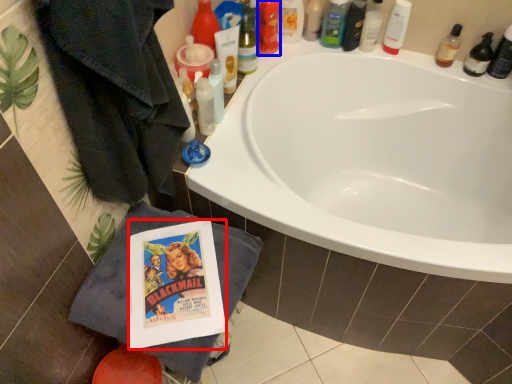
Question: Which object is closer to the camera taking this photo, comic book (highlighted by a red box) or toiletry (highlighted by a blue box)?

Choices:
 (A) comic book
 (B) toiletry

Answer: (A)